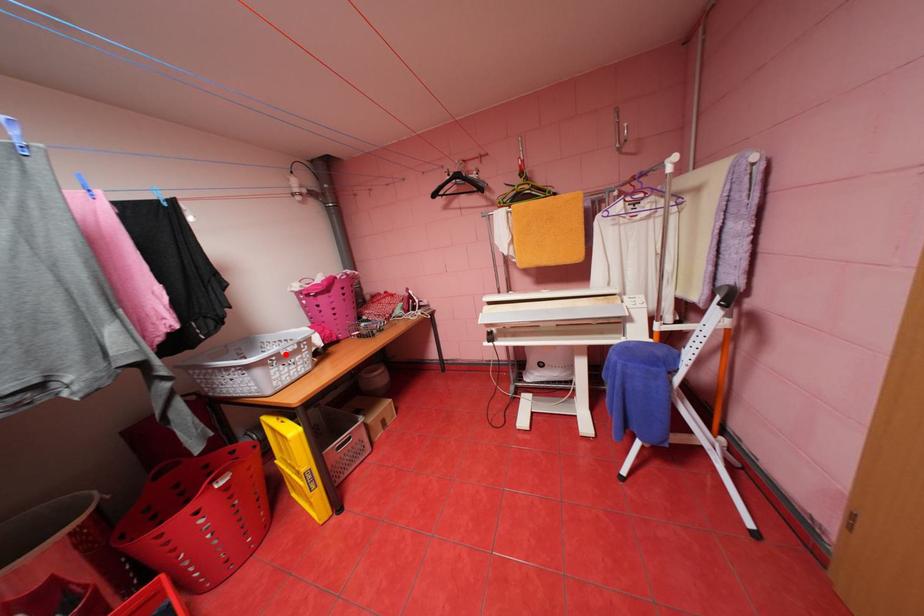
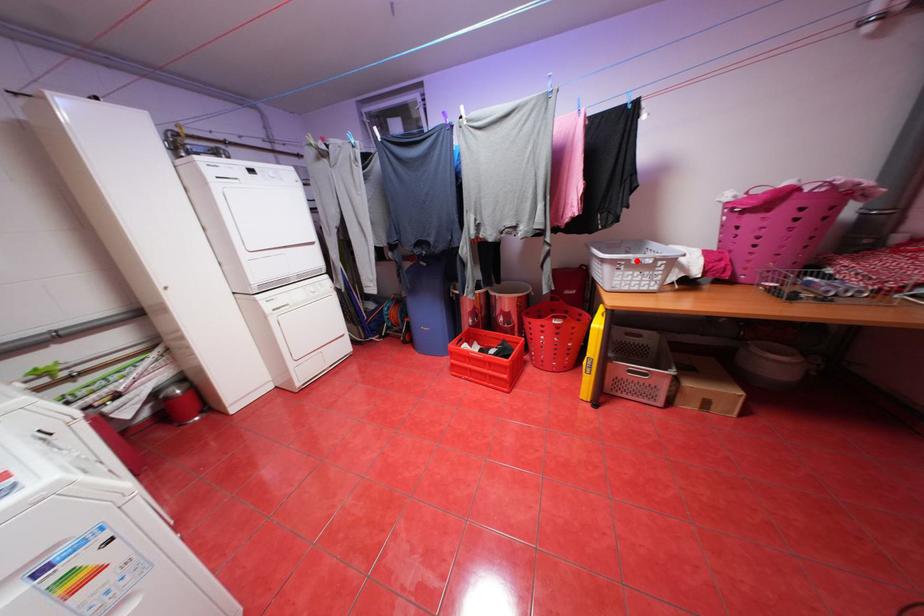
I am providing you with two images of the same scene from different viewpoints. A red point is marked on the first image and another point is marked on the second image. Is the marked point in image1 the same physical position as the marked point in image2?

Yes